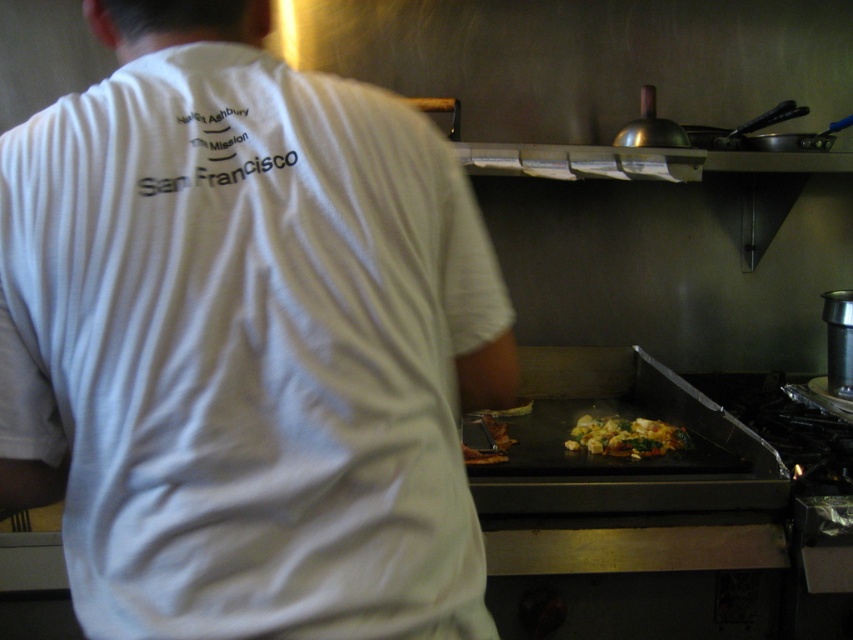
Question: Which point is farther from the camera taking this photo?

Choices:
 (A) (628, 436)
 (B) (227, 52)
 (C) (207, 141)

Answer: (A)

Question: In this image, where is white cotton shirt at center located relative to white fabric text at upper center?

Choices:
 (A) above
 (B) below

Answer: (B)

Question: Which object is the farthest from the multicolored glossy vegetables at center?

Choices:
 (A) white fabric text at upper center
 (B) white cotton shirt at center
 (C) green leafy vegetables at center

Answer: (A)

Question: From the image, what is the correct spatial relationship of white fabric text at upper center in relation to green leafy vegetables at center?

Choices:
 (A) left
 (B) right

Answer: (A)

Question: Considering the relative positions of white fabric text at upper center and multicolored glossy vegetables at center in the image provided, where is white fabric text at upper center located with respect to multicolored glossy vegetables at center?

Choices:
 (A) right
 (B) left

Answer: (B)

Question: Which object is farther from the camera taking this photo?

Choices:
 (A) white fabric text at upper center
 (B) white cotton shirt at center
 (C) multicolored glossy vegetables at center
 (D) green leafy vegetables at center

Answer: (C)